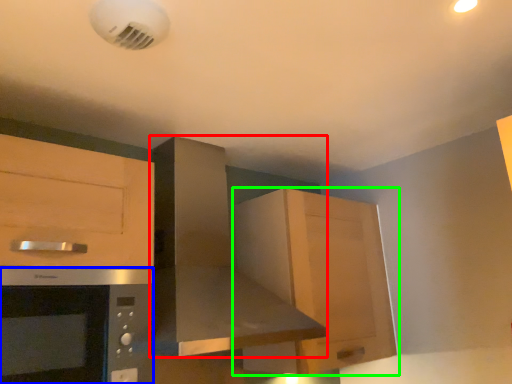
Question: Which object is the closest to the home appliance (highlighted by a red box)? Choose among these: microwave oven (highlighted by a blue box) or cabinetry (highlighted by a green box).

Choices:
 (A) microwave oven
 (B) cabinetry

Answer: (B)